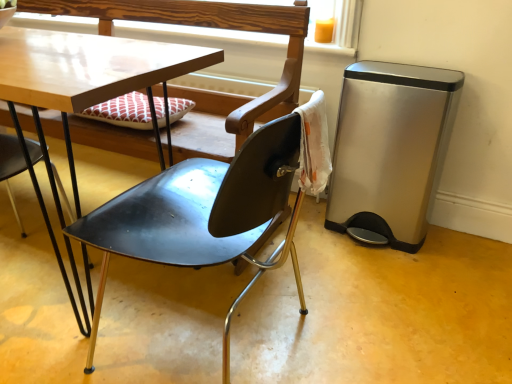
What do you see at coordinates (391, 149) in the screenshot? Image resolution: width=512 pixels, height=384 pixels. I see `satin silver trash can at right` at bounding box center [391, 149].

This screenshot has height=384, width=512. What do you see at coordinates (336, 28) in the screenshot? I see `wooden at upper center` at bounding box center [336, 28].

Locate an element on the screen. satin silver trash can at right is located at coordinates (391, 149).

From the picture: From a real-world perspective, is satin silver trash can at right located beneath black metal chair at lower left, which appears as the 1th chair when viewed from the left?

No, from a real-world perspective, satin silver trash can at right is not beneath black metal chair at lower left, which appears as the 1th chair when viewed from the left.

Between point (358, 139) and point (8, 184), which one is positioned in front?

Positioned in front is point (358, 139).

Is satin silver trash can at right far away from black metal chair at lower left, which appears as the 1th chair when viewed from the left?

Yes, satin silver trash can at right and black metal chair at lower left, which appears as the 1th chair when viewed from the left, are quite far apart.

Looking at the image, does satin silver trash can at right seem bigger or smaller compared to black metal chair at lower left, the second chair when ordered from right to left?

satin silver trash can at right is bigger than black metal chair at lower left, the second chair when ordered from right to left.

From the image's perspective, is wooden at upper center beneath satin silver trash can at right?

Incorrect, from the image's perspective, wooden at upper center is higher than satin silver trash can at right.

Measure the distance from wooden at upper center to satin silver trash can at right.

wooden at upper center and satin silver trash can at right are 21.02 inches apart.

Which object is closer to the camera taking this photo, wooden at upper center or satin silver trash can at right?

satin silver trash can at right is in front.

Looking at this image, how many degrees apart are the facing directions of wooden at upper center and satin silver trash can at right?

There is a 3.6-degree angle between the facing directions of wooden at upper center and satin silver trash can at right.

Is matte black chair at center, arranged as the first chair when viewed from the right, turned away from black metal chair at lower left, the second chair when ordered from right to left?

Yes, matte black chair at center, arranged as the first chair when viewed from the right, is facing away from black metal chair at lower left, the second chair when ordered from right to left.

From the image's perspective, which is above, matte black chair at center, which is counted as the 2th chair, starting from the left, or black metal chair at lower left, which appears as the 1th chair when viewed from the left?

From the image's view, matte black chair at center, which is counted as the 2th chair, starting from the left, is above.

Is matte black chair at center, which is counted as the 2th chair, starting from the left, positioned in front of black metal chair at lower left, the second chair when ordered from right to left?

No.

From a real-world perspective, is wooden at upper center on top of matte black chair at center, which is counted as the 2th chair, starting from the left?

Yes, from a real-world perspective, wooden at upper center is over matte black chair at center, which is counted as the 2th chair, starting from the left

Is point (339, 13) farther from camera compared to point (180, 8)?

No, (339, 13) is closer to viewer.

From the image's perspective, is wooden at upper center located beneath matte black chair at center, which is counted as the 2th chair, starting from the left?

No.

Can you confirm if wooden at upper center is taller than matte black chair at center, arranged as the first chair when viewed from the right?

In fact, wooden at upper center may be shorter than matte black chair at center, arranged as the first chair when viewed from the right.

Between point (21, 224) and point (398, 123), which one is positioned behind?

Point (21, 224)

Could you tell me if black metal chair at lower left, the second chair when ordered from right to left, is facing satin silver trash can at right?

No, black metal chair at lower left, the second chair when ordered from right to left, is not aimed at satin silver trash can at right.

Which of these two, satin silver trash can at right or wooden at upper center, is smaller?

With smaller size is wooden at upper center.

At what (x,y) coordinates should I click in order to perform the action: click on trash bin/can in front of the wooden at upper center. Please return your answer as a coordinate pair (x, y). This screenshot has height=384, width=512. Looking at the image, I should click on (391, 149).

Which object is positioned more to the left, satin silver trash can at right or wooden at upper center?

wooden at upper center.

Is black metal chair at lower left, which appears as the 1th chair when viewed from the left, completely or partially outside of wooden at upper center?

Absolutely, black metal chair at lower left, which appears as the 1th chair when viewed from the left, is external to wooden at upper center.

From a real-world perspective, is black metal chair at lower left, which appears as the 1th chair when viewed from the left, on wooden at upper center?

No, from a real-world perspective, black metal chair at lower left, which appears as the 1th chair when viewed from the left, is not above wooden at upper center.

Consider the image. Could you tell me if black metal chair at lower left, which appears as the 1th chair when viewed from the left, is turned towards wooden at upper center?

Yes.

Who is more distant, black metal chair at lower left, the second chair when ordered from right to left, or wooden at upper center?

wooden at upper center.

Find the location of `chair below the satin silver trash can at right (from the image's perspective)`. chair below the satin silver trash can at right (from the image's perspective) is located at coordinates (11, 165).

Identify the location of window frame that is behind the satin silver trash can at right. (336, 28).

Which object lies nearer to the anchor point black metal chair at lower left, which appears as the 1th chair when viewed from the left, satin silver trash can at right or wooden at upper center?

Based on the image, wooden at upper center appears to be nearer to black metal chair at lower left, which appears as the 1th chair when viewed from the left.

From the image, which object appears to be farther from black metal chair at lower left, which appears as the 1th chair when viewed from the left, wooden at upper center or matte black chair at center, which is counted as the 2th chair, starting from the left?

Based on the image, wooden at upper center appears to be further to black metal chair at lower left, which appears as the 1th chair when viewed from the left.

Looking at the image, which one is located closer to matte black chair at center, which is counted as the 2th chair, starting from the left, black metal chair at lower left, which appears as the 1th chair when viewed from the left, or wooden at upper center?

black metal chair at lower left, which appears as the 1th chair when viewed from the left, is positioned closer to the anchor matte black chair at center, which is counted as the 2th chair, starting from the left.

Looking at the image, which one is located closer to satin silver trash can at right, wooden at upper center or matte black chair at center, which is counted as the 2th chair, starting from the left?

wooden at upper center is closer to satin silver trash can at right.

Considering their positions, is matte black chair at center, arranged as the first chair when viewed from the right, positioned further to black metal chair at lower left, the second chair when ordered from right to left, than satin silver trash can at right?

satin silver trash can at right is further to black metal chair at lower left, the second chair when ordered from right to left.

When comparing their distances from wooden at upper center, does matte black chair at center, which is counted as the 2th chair, starting from the left, or black metal chair at lower left, the second chair when ordered from right to left, seem closer?

Among the two, matte black chair at center, which is counted as the 2th chair, starting from the left, is located nearer to wooden at upper center.

Looking at the image, which one is located closer to satin silver trash can at right, matte black chair at center, arranged as the first chair when viewed from the right, or wooden at upper center?

Based on the image, wooden at upper center appears to be nearer to satin silver trash can at right.

Based on their spatial positions, is black metal chair at lower left, the second chair when ordered from right to left, or matte black chair at center, arranged as the first chair when viewed from the right, closer to wooden at upper center?

matte black chair at center, arranged as the first chair when viewed from the right, lies closer to wooden at upper center than the other object.

Identify the location of window frame between black metal chair at lower left, the second chair when ordered from right to left, and satin silver trash can at right from left to right. (336, 28).

At what (x,y) coordinates should I click in order to perform the action: click on chair between wooden at upper center and black metal chair at lower left, the second chair when ordered from right to left, in the vertical direction. Please return your answer as a coordinate pair (x, y). The width and height of the screenshot is (512, 384). Looking at the image, I should click on pos(165,224).

Locate an element on the screen. chair between black metal chair at lower left, the second chair when ordered from right to left, and satin silver trash can at right is located at coordinates (165, 224).

Where is `window frame between matte black chair at center, which is counted as the 2th chair, starting from the left, and satin silver trash can at right, in the horizontal direction`? window frame between matte black chair at center, which is counted as the 2th chair, starting from the left, and satin silver trash can at right, in the horizontal direction is located at coordinates (336, 28).